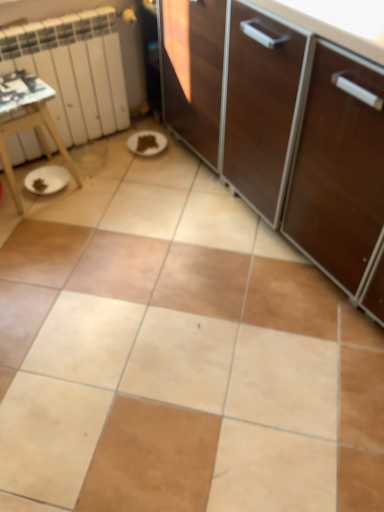
Question: From a real-world perspective, is white wooden table at left under white matte radiator at left?

Choices:
 (A) no
 (B) yes

Answer: (B)

Question: Can you confirm if white wooden table at left is shorter than white matte radiator at left?

Choices:
 (A) yes
 (B) no

Answer: (A)

Question: Is white wooden table at left positioned with its back to white matte radiator at left?

Choices:
 (A) yes
 (B) no

Answer: (A)

Question: Does white wooden table at left come behind white matte radiator at left?

Choices:
 (A) yes
 (B) no

Answer: (B)

Question: Would you say white wooden table at left is a long distance from white matte radiator at left?

Choices:
 (A) yes
 (B) no

Answer: (B)

Question: Is white wooden table at left placed right next to white matte radiator at left?

Choices:
 (A) no
 (B) yes

Answer: (A)

Question: From a real-world perspective, does white matte radiator at left sit lower than white wooden table at left?

Choices:
 (A) no
 (B) yes

Answer: (A)

Question: Is white matte radiator at left to the right of white wooden table at left from the viewer's perspective?

Choices:
 (A) yes
 (B) no

Answer: (A)

Question: Is white matte radiator at left next to white wooden table at left?

Choices:
 (A) no
 (B) yes

Answer: (A)

Question: Does white matte radiator at left turn towards white wooden table at left?

Choices:
 (A) yes
 (B) no

Answer: (A)

Question: Can you confirm if white matte radiator at left is smaller than white wooden table at left?

Choices:
 (A) yes
 (B) no

Answer: (B)

Question: Is white matte radiator at left far away from white wooden table at left?

Choices:
 (A) no
 (B) yes

Answer: (A)

Question: Would you say white matte radiator at left is inside or outside white wooden table at left?

Choices:
 (A) inside
 (B) outside

Answer: (B)